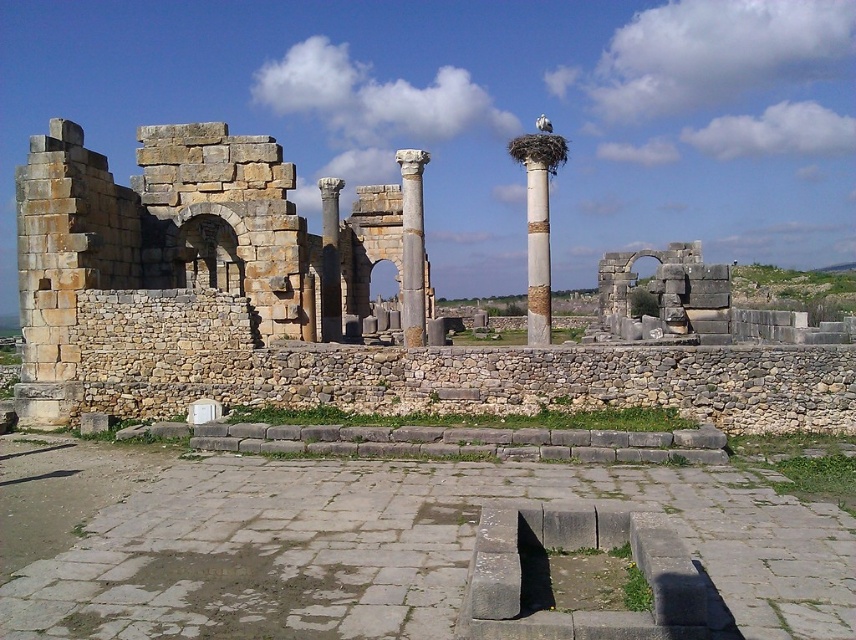
Question: Is rustic stone column at center wider than gray stone column at center?

Choices:
 (A) no
 (B) yes

Answer: (B)

Question: Is yellowish stone ruins at center to the right of smooth stone column at center from the viewer's perspective?

Choices:
 (A) yes
 (B) no

Answer: (A)

Question: Estimate the real-world distances between objects in this image. Which object is farther from the gray stone column at center?

Choices:
 (A) smooth stone column at center
 (B) white marble column at center
 (C) rustic stone column at center

Answer: (B)

Question: Which is nearer to the yellowish stone ruins at center?

Choices:
 (A) white marble column at center
 (B) smooth stone column at center

Answer: (B)

Question: Among these points, which one is nearest to the camera?

Choices:
 (A) (119, 188)
 (B) (403, 333)
 (C) (548, 312)

Answer: (C)

Question: Does yellowish stone ruins at center have a smaller size compared to stone archway at center?

Choices:
 (A) yes
 (B) no

Answer: (A)